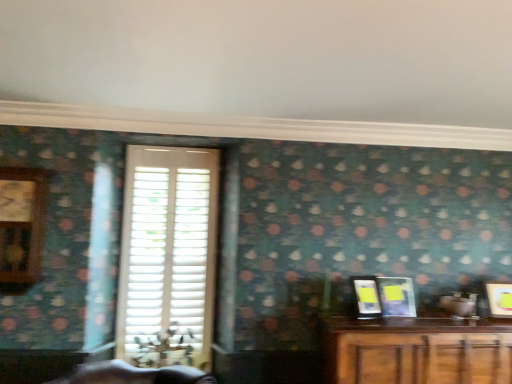
Question: Is wooden clock at left smaller than matte yellow picture frame at right, which ranks as the 3th picture frame in left-to-right order?

Choices:
 (A) no
 (B) yes

Answer: (A)

Question: Is matte yellow picture frame at right, marked as the 1th picture frame in a right-to-left arrangement, at the back of wooden clock at left?

Choices:
 (A) yes
 (B) no

Answer: (B)

Question: Is wooden clock at left next to matte yellow picture frame at right, marked as the 1th picture frame in a right-to-left arrangement, and touching it?

Choices:
 (A) yes
 (B) no

Answer: (B)

Question: Does wooden clock at left have a larger size compared to matte yellow picture frame at right, which ranks as the 3th picture frame in left-to-right order?

Choices:
 (A) yes
 (B) no

Answer: (A)

Question: Is wooden clock at left positioned beyond the bounds of matte yellow picture frame at right, which ranks as the 3th picture frame in left-to-right order?

Choices:
 (A) yes
 (B) no

Answer: (A)

Question: Is matte yellow picture frame at right, which ranks as the 3th picture frame in left-to-right order, to the left or to the right of wooden clock at left in the image?

Choices:
 (A) right
 (B) left

Answer: (A)

Question: In terms of width, does matte yellow picture frame at right, which ranks as the 3th picture frame in left-to-right order, look wider or thinner when compared to wooden clock at left?

Choices:
 (A) wide
 (B) thin

Answer: (B)

Question: In terms of size, does matte yellow picture frame at right, which ranks as the 3th picture frame in left-to-right order, appear bigger or smaller than wooden clock at left?

Choices:
 (A) small
 (B) big

Answer: (A)

Question: Which is correct: matte yellow picture frame at right, marked as the 1th picture frame in a right-to-left arrangement, is inside wooden clock at left, or outside of it?

Choices:
 (A) inside
 (B) outside

Answer: (B)

Question: Based on their positions, is wooden clock at left located to the left or right of matte black picture frame at right, arranged as the first picture frame when viewed from the left?

Choices:
 (A) right
 (B) left

Answer: (B)

Question: From a real-world perspective, relative to matte black picture frame at right, arranged as the first picture frame when viewed from the left, is wooden clock at left vertically above or below?

Choices:
 (A) below
 (B) above

Answer: (B)

Question: Considering the positions of point click(44, 225) and point click(375, 304), is point click(44, 225) closer or farther from the camera than point click(375, 304)?

Choices:
 (A) closer
 (B) farther

Answer: (A)

Question: Is wooden clock at left taller or shorter than matte black picture frame at right, arranged as the first picture frame when viewed from the left?

Choices:
 (A) short
 (B) tall

Answer: (B)

Question: Considering their positions, is metallic silver picture frame at right, the second picture frame in the left-to-right sequence, located in front of or behind wooden clock at left?

Choices:
 (A) behind
 (B) front

Answer: (A)

Question: Looking at the image, does metallic silver picture frame at right, which is counted as the second picture frame, starting from the right, seem bigger or smaller compared to wooden clock at left?

Choices:
 (A) small
 (B) big

Answer: (A)